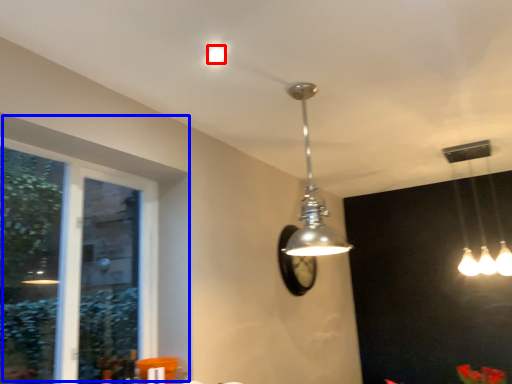
Question: Which object is further to the camera taking this photo, droplight (highlighted by a red box) or window (highlighted by a blue box)?

Choices:
 (A) droplight
 (B) window

Answer: (A)